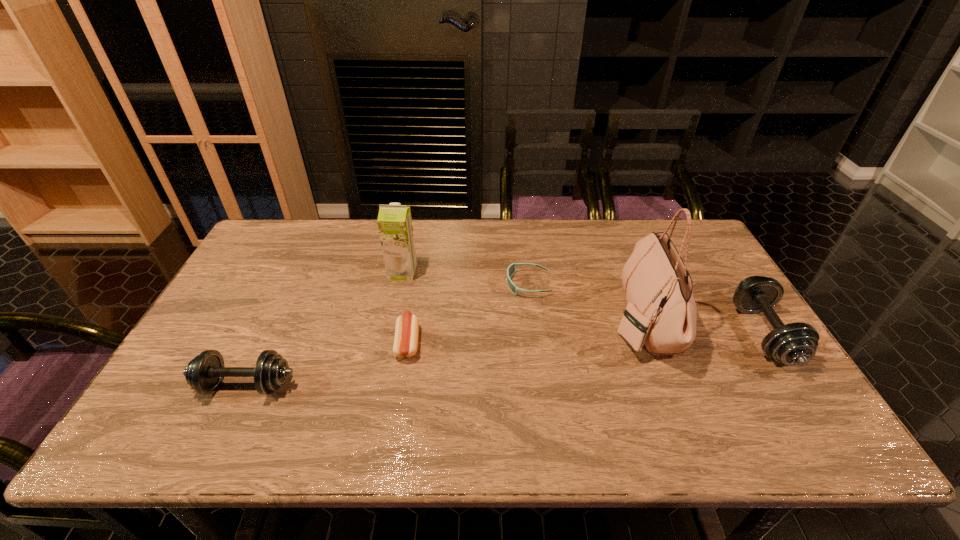
At what (x,y) coordinates should I click in order to perform the action: click on free area in between the fourth tallest object and the soya milk. Please return your answer as a coordinate pair (x, y). The image size is (960, 540). Looking at the image, I should click on (324, 329).

Image resolution: width=960 pixels, height=540 pixels. I want to click on vacant area that lies between the sausage and the fourth object from left to right, so click(x=468, y=313).

Find the location of `empty space that is in between the handbag and the fifth shortest object`. empty space that is in between the handbag and the fifth shortest object is located at coordinates (522, 295).

The width and height of the screenshot is (960, 540). What are the coordinates of `free space between the second tallest object and the leftmost object` in the screenshot? It's located at (324, 329).

The image size is (960, 540). I want to click on vacant point located between the right dumbbell and the soya milk, so coord(583,303).

Where is `free spot between the goggles and the tallest object`? Image resolution: width=960 pixels, height=540 pixels. free spot between the goggles and the tallest object is located at coordinates (586, 301).

This screenshot has height=540, width=960. What are the coordinates of `vacant point located between the handbag and the goggles` in the screenshot? It's located at (586, 301).

Identify which object is the fifth nearest to the fourth shortest object. Please provide its 2D coordinates. Your answer should be formatted as a tuple, i.e. [(x, y)], where the tuple contains the x and y coordinates of a point satisfying the conditions above.

[(204, 373)]

Select which object appears as the second closest to the goggles. Please provide its 2D coordinates. Your answer should be formatted as a tuple, i.e. [(x, y)], where the tuple contains the x and y coordinates of a point satisfying the conditions above.

[(407, 326)]

Where is `vacant space that satisfies the following two spatial constraints: 1. on the back side of the rightmost object; 2. on the side of the tallest object with the attached pouch`? This screenshot has height=540, width=960. vacant space that satisfies the following two spatial constraints: 1. on the back side of the rightmost object; 2. on the side of the tallest object with the attached pouch is located at coordinates (754, 319).